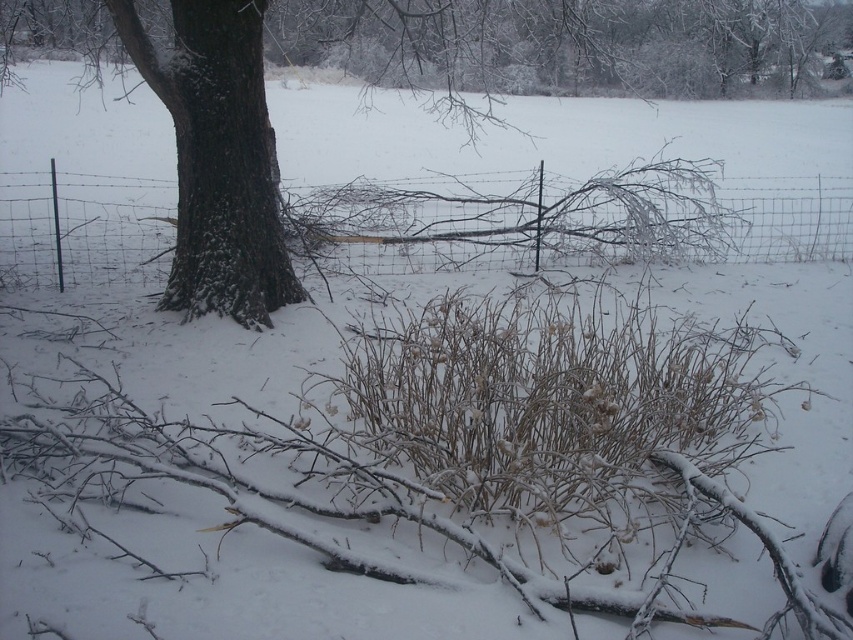
Describe the element at coordinates (570, 220) in the screenshot. I see `wire mesh fence at center` at that location.

Who is more distant from viewer, (x=677, y=225) or (x=256, y=307)?

The point (x=677, y=225) is more distant.

Is point (469, 248) positioned after point (221, 243)?

Yes, it is.

Identify the location of wire mesh fence at center. (570, 220).